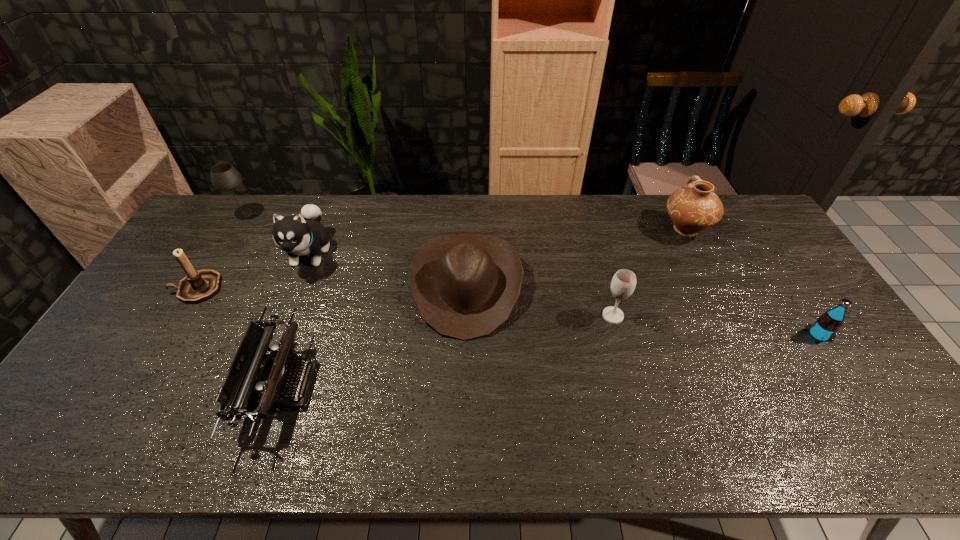
Identify the location of free location at the far right corner. (731, 208).

Locate an element on the screen. unoccupied area between the left wineglass and the soda is located at coordinates (531, 274).

Where is `free space that is in between the candle holder and the right wineglass`? free space that is in between the candle holder and the right wineglass is located at coordinates (405, 302).

Locate an element on the screen. This screenshot has width=960, height=540. free spot between the left wineglass and the typewriter is located at coordinates (262, 299).

Where is `free space between the candle holder and the farther wineglass`? Image resolution: width=960 pixels, height=540 pixels. free space between the candle holder and the farther wineglass is located at coordinates (220, 251).

Where is `free space that is in between the fifth object from left to right and the puppy`? This screenshot has height=540, width=960. free space that is in between the fifth object from left to right and the puppy is located at coordinates (389, 269).

Find the location of `free space between the sixth object from left to right and the candle holder`. free space between the sixth object from left to right and the candle holder is located at coordinates (405, 302).

This screenshot has width=960, height=540. What are the coordinates of `empty space that is in between the cowboy hat and the seventh object from left to right` in the screenshot? It's located at (576, 258).

This screenshot has height=540, width=960. Find the location of `free area in between the rightmost object and the left wineglass`. free area in between the rightmost object and the left wineglass is located at coordinates (531, 274).

Locate an element on the screen. object identified as the third closest to the candle holder is located at coordinates (224, 177).